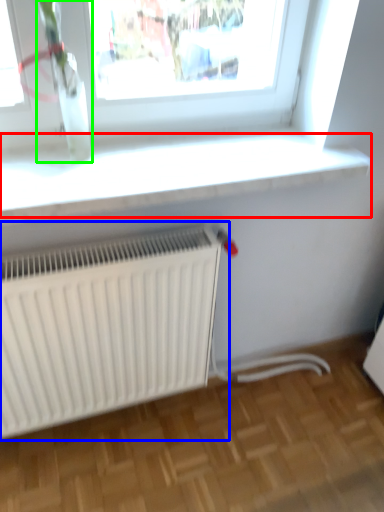
Question: Estimate the real-world distances between objects in this image. Which object is farther from window sill (highlighted by a red box), radiator (highlighted by a blue box) or plant (highlighted by a green box)?

Choices:
 (A) radiator
 (B) plant

Answer: (A)